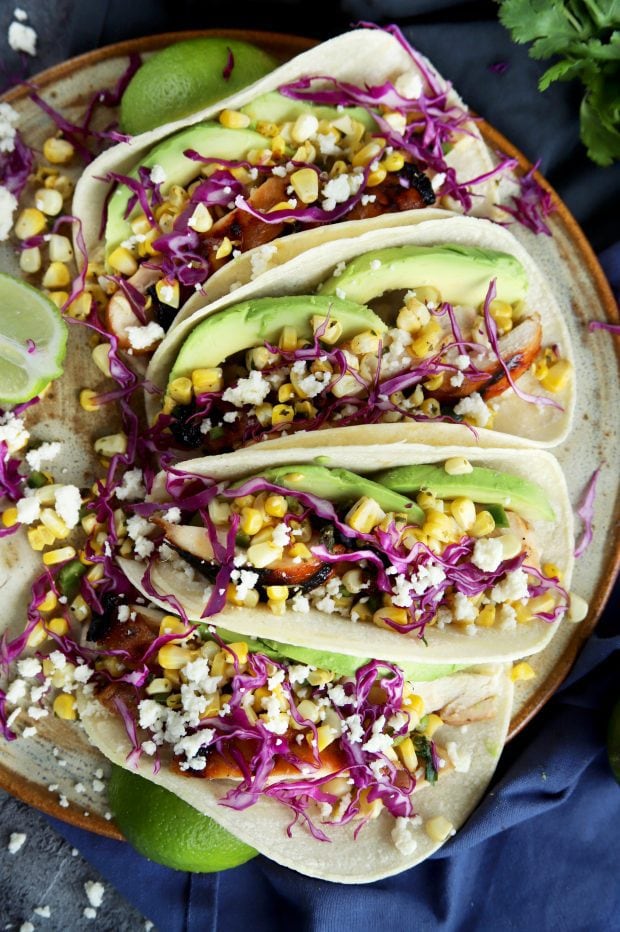
This screenshot has height=932, width=620. Identify the location of 1 black napkin. (22, 925).